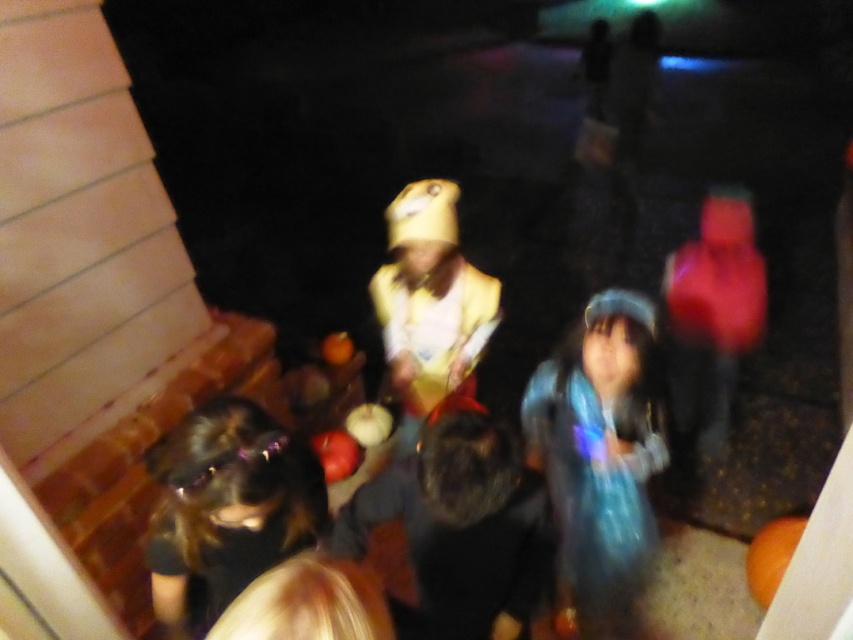
Question: Can you confirm if black furry dog at center is thinner than black shiny hair at lower left?

Choices:
 (A) no
 (B) yes

Answer: (A)

Question: Does translucent blue dress at center have a lesser width compared to black furry dog at center?

Choices:
 (A) yes
 (B) no

Answer: (B)

Question: Does translucent blue dress at center have a larger size compared to black furry dog at center?

Choices:
 (A) yes
 (B) no

Answer: (A)

Question: Which point is closer to the camera taking this photo?

Choices:
 (A) [209, 419]
 (B) [593, 627]
 (C) [390, 252]

Answer: (A)

Question: Which object is positioned closest to the yellow matte costume at center?

Choices:
 (A) black shiny hair at lower left
 (B) translucent blue dress at center

Answer: (B)

Question: Which point appears farthest from the camera in this image?

Choices:
 (A) (563, 433)
 (B) (421, 198)
 (C) (291, 476)
 (D) (460, 595)

Answer: (A)